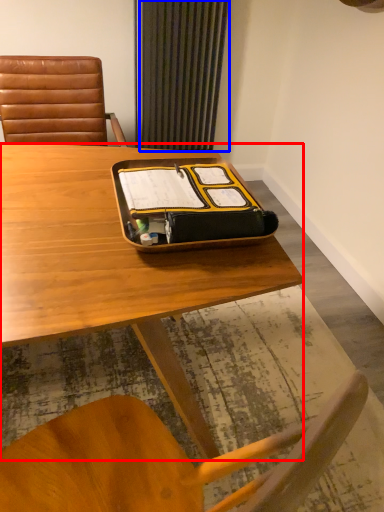
Question: Which object is closer to the camera taking this photo, desk (highlighted by a red box) or curtain (highlighted by a blue box)?

Choices:
 (A) desk
 (B) curtain

Answer: (A)